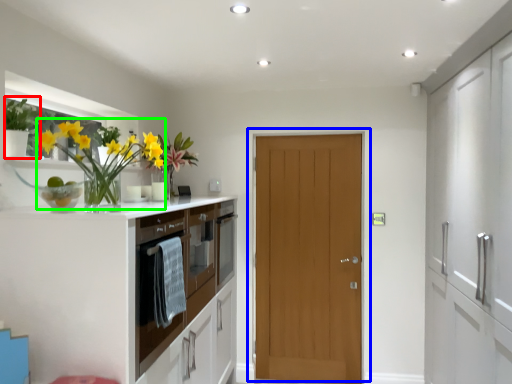
Question: Which object is the closest to the plant (highlighted by a red box)? Choose among these: door (highlighted by a blue box) or floral arrangement (highlighted by a green box).

Choices:
 (A) door
 (B) floral arrangement

Answer: (B)